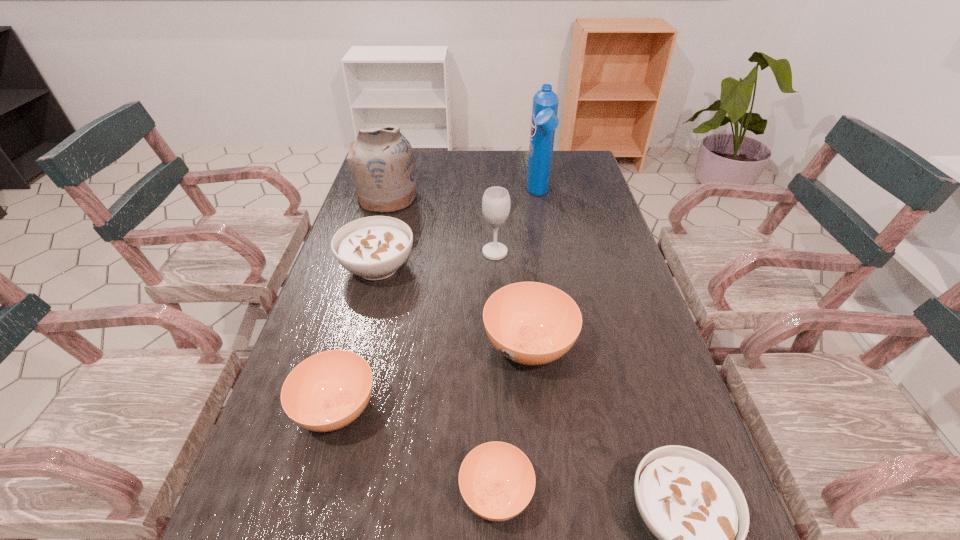
In the image, there is a desktop. Identify the location of free space at the right edge. The height and width of the screenshot is (540, 960). (610, 321).

At what (x,y) coordinates should I click in order to perform the action: click on vacant space at the far right corner of the desktop. Please return your answer as a coordinate pair (x, y). Looking at the image, I should click on (588, 166).

Where is `vacant space that's between the biggest peach soup bowl and the second biggest peach soup bowl`? The image size is (960, 540). vacant space that's between the biggest peach soup bowl and the second biggest peach soup bowl is located at coordinates (433, 377).

Find the location of a particular element. The width and height of the screenshot is (960, 540). vacant region between the bigger white soup bowl and the wineglass is located at coordinates (437, 260).

The height and width of the screenshot is (540, 960). Identify the location of unoccupied position between the tallest object and the farther white soup bowl. (458, 231).

At what (x,y) coordinates should I click in order to perform the action: click on unoccupied area between the second smallest peach soup bowl and the nearest peach soup bowl. Please return your answer as a coordinate pair (x, y). Looking at the image, I should click on (417, 451).

Select which object appears as the second closest to the wineglass. Please provide its 2D coordinates. Your answer should be formatted as a tuple, i.e. [(x, y)], where the tuple contains the x and y coordinates of a point satisfying the conditions above.

[(544, 121)]

Identify the location of the fifth closest object relative to the wineglass. The width and height of the screenshot is (960, 540). (327, 391).

You are a GUI agent. You are given a task and a screenshot of the screen. Output one action in this format:
    pyautogui.click(x=<x>, y=<y>)
    Task: Click on the soup bowl identified as the fourth closest to the shortest object
    
    Given the screenshot: What is the action you would take?
    pyautogui.click(x=374, y=247)

You are a GUI agent. You are given a task and a screenshot of the screen. Output one action in this format:
    pyautogui.click(x=<x>, y=<y>)
    Task: Click on the soup bowl identified as the fourth closest to the wineglass
    
    Given the screenshot: What is the action you would take?
    pyautogui.click(x=497, y=481)